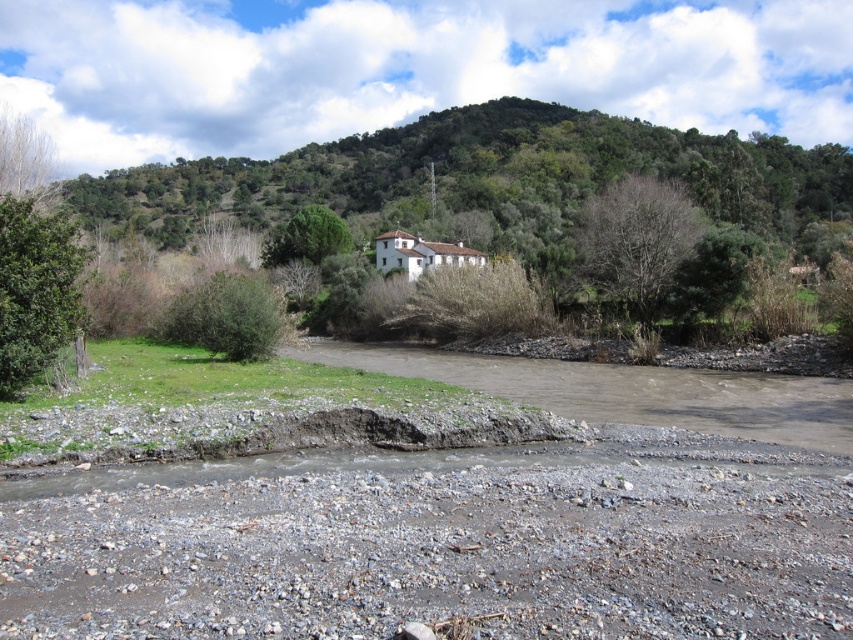
Is green leafy tree at left to the left of green leafy bush at lower left from the viewer's perspective?

In fact, green leafy tree at left is to the right of green leafy bush at lower left.

Does green leafy tree at left have a greater width compared to green leafy bush at lower left?

No.

Where is `green leafy tree at left`? green leafy tree at left is located at coordinates (35, 291).

Is point (77, 260) farther from viewer compared to point (659, 234)?

No, it is not.

Who is more forward, (22,241) or (637,234)?

Point (22,241) is in front.

The height and width of the screenshot is (640, 853). In order to click on green leafy tree at left in this screenshot , I will do `click(35, 291)`.

Does green leafy tree at left have a smaller size compared to green leafy tree at upper center?

Yes, green leafy tree at left is smaller than green leafy tree at upper center.

Which of these two, green leafy tree at left or green leafy tree at upper center, stands taller?

With more height is green leafy tree at upper center.

Describe the element at coordinates (35, 291) in the screenshot. The width and height of the screenshot is (853, 640). I see `green leafy tree at left` at that location.

You are a GUI agent. You are given a task and a screenshot of the screen. Output one action in this format:
    pyautogui.click(x=<x>, y=<y>)
    Task: Click on the green leafy tree at left
    The width and height of the screenshot is (853, 640).
    Given the screenshot: What is the action you would take?
    pyautogui.click(x=35, y=291)